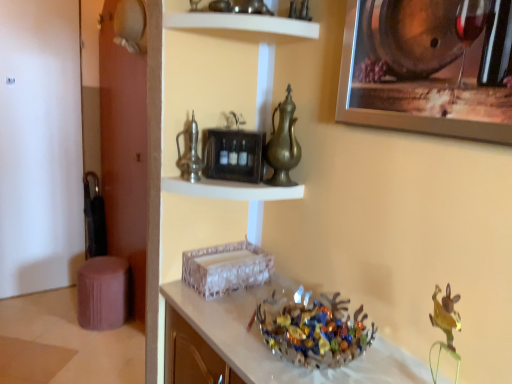
The height and width of the screenshot is (384, 512). I want to click on vacant area on top of purple fabric stool at lower left (from a real-world perspective), so click(x=105, y=263).